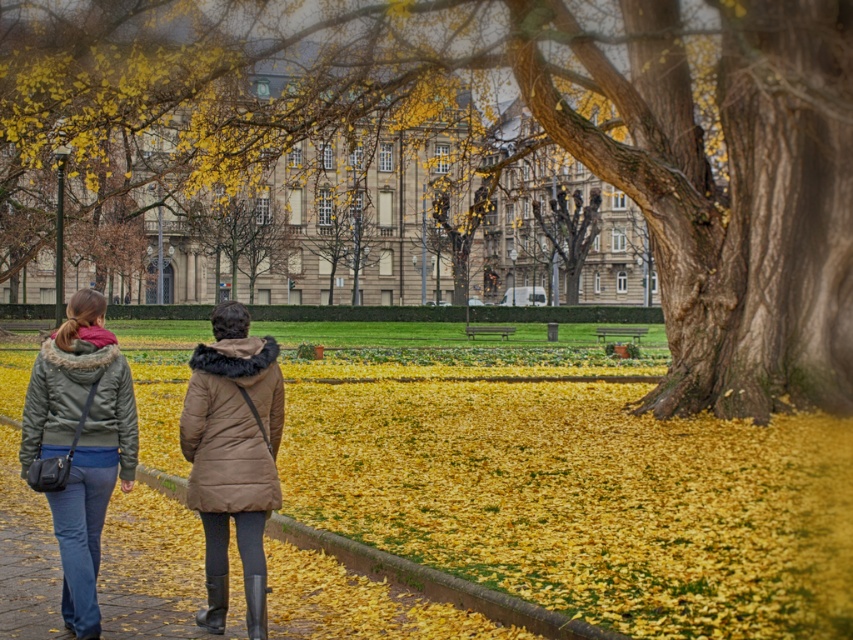
You are standing at the point marked by point (80, 442). Which direction should you walk to reach the matte green jacket at lower left?

The point (80, 442) already marks the location of the matte green jacket at lower left, so you are already at that position.